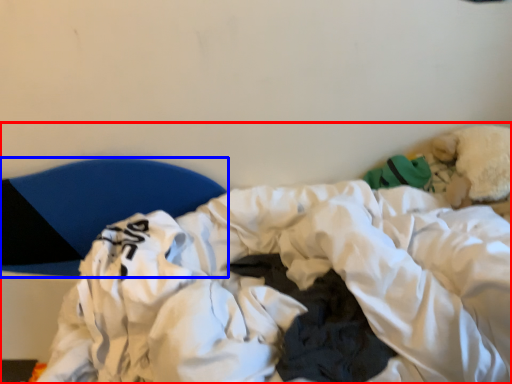
Question: Which point is further to the camera, hospital bed (highlighted by a red box) or furniture (highlighted by a blue box)?

Choices:
 (A) hospital bed
 (B) furniture

Answer: (B)